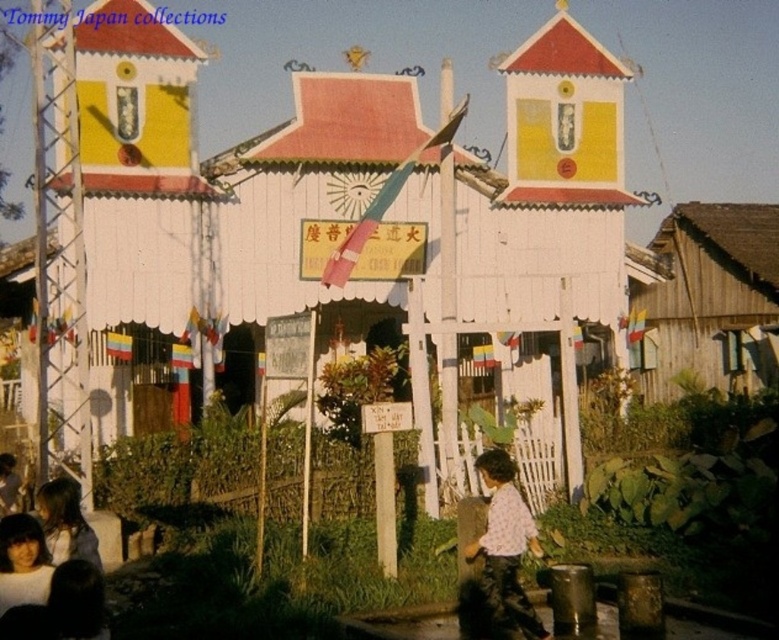
Question: Observing the image, what is the correct spatial positioning of wooden hut at right in reference to white textured shirt at center?

Choices:
 (A) right
 (B) left

Answer: (A)

Question: Where is white wood hut at center located in relation to light brown hair at lower left in the image?

Choices:
 (A) above
 (B) below

Answer: (A)

Question: Among these points, which one is farthest from the camera?

Choices:
 (A) (751, 346)
 (B) (143, 104)

Answer: (A)

Question: Which of the following is the farthest from the observer?

Choices:
 (A) light brown hair at lower left
 (B) white textured shirt at center

Answer: (B)

Question: Is the position of white wood hut at center more distant than that of light brown hair at lower left?

Choices:
 (A) no
 (B) yes

Answer: (B)

Question: Which object is farther from the camera taking this photo?

Choices:
 (A) wooden hut at right
 (B) light brown hair at lower left
 (C) white wood hut at center
 (D) white textured shirt at center

Answer: (A)